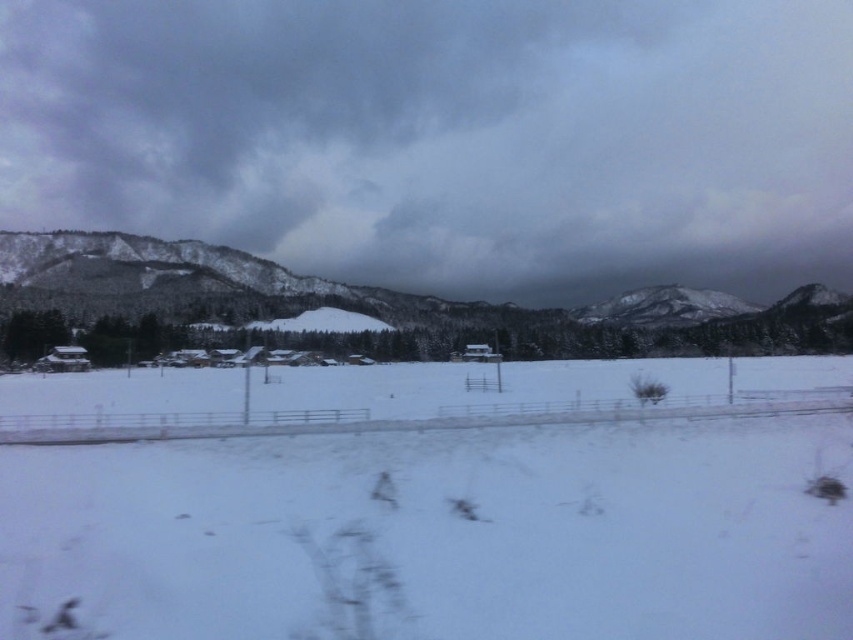
You are standing at the point marked as point [447,529] in the winter landscape image. What is the terrain like directly beneath your feet?

The terrain directly beneath point [447,529] is white powdery snow at center.